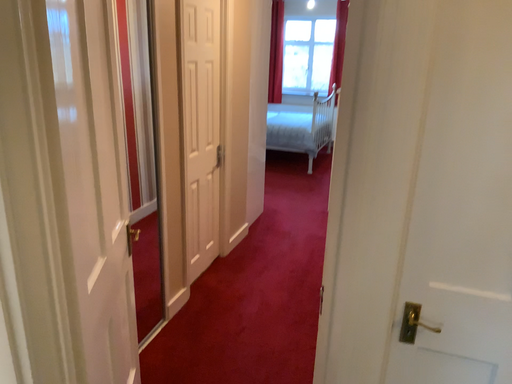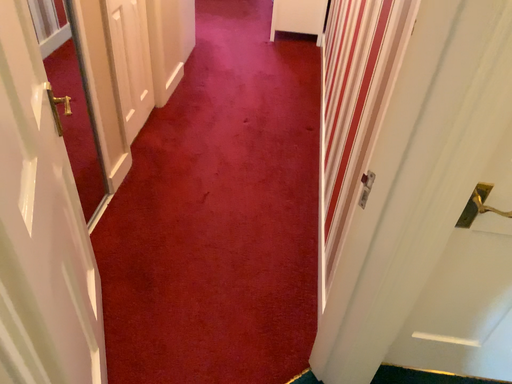
Question: How did the camera likely rotate when shooting the video?

Choices:
 (A) rotated downward
 (B) rotated upward

Answer: (A)